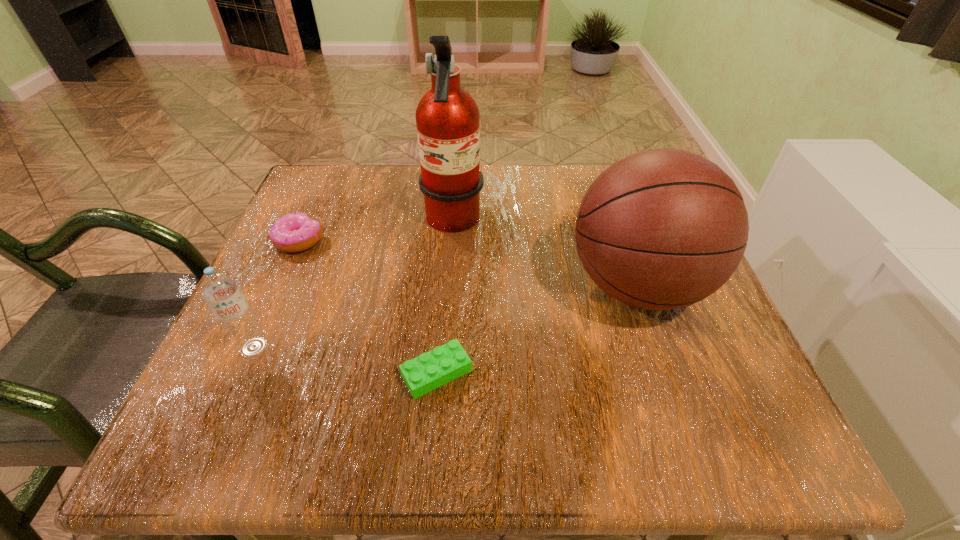
The width and height of the screenshot is (960, 540). Identify the location of vacant space located on the back of the Lego. (448, 228).

The image size is (960, 540). Identify the location of object located in the far edge section of the desktop. (447, 118).

Locate an element on the screen. object that is positioned at the near edge is located at coordinates (430, 370).

At what (x,y) coordinates should I click in order to perform the action: click on water bottle located at the left edge. Please return your answer as a coordinate pair (x, y). This screenshot has width=960, height=540. Looking at the image, I should click on (220, 290).

Locate an element on the screen. doughnut situated at the left edge is located at coordinates (295, 232).

The image size is (960, 540). I want to click on object that is at the right edge, so click(661, 229).

Identify the location of free space at the far edge of the desktop. The image size is (960, 540). (513, 173).

Where is `vacant space at the near edge of the desktop`? vacant space at the near edge of the desktop is located at coordinates [464, 420].

The image size is (960, 540). Identify the location of vacant space at the left edge. point(324,255).

At what (x,y) coordinates should I click in order to perform the action: click on free point at the right edge. Please return your answer as a coordinate pair (x, y). Looking at the image, I should click on (699, 315).